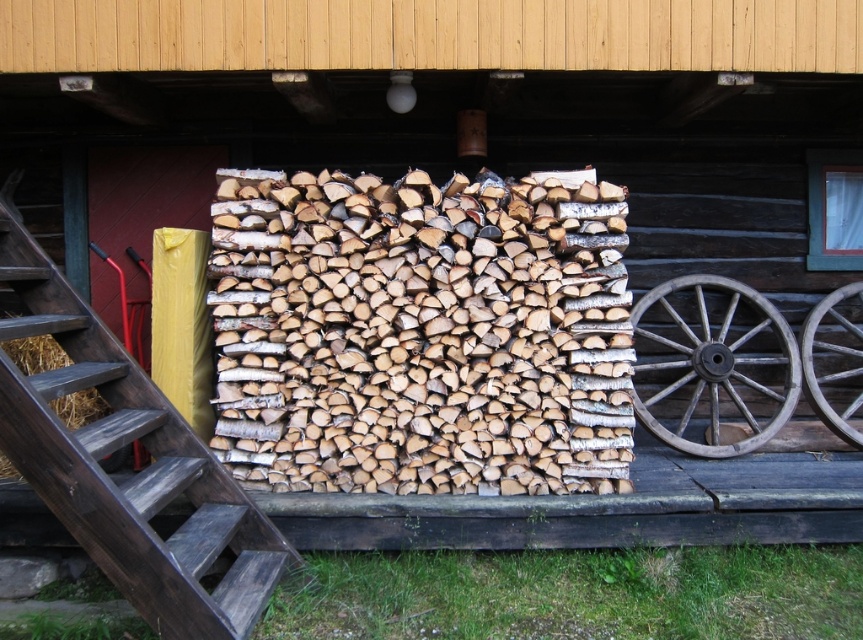
Question: Can you confirm if wooden stairs at left is positioned to the right of dark brown wooden wagon wheel at right?

Choices:
 (A) no
 (B) yes

Answer: (A)

Question: Does wooden stairs at left lie in front of wooden at right?

Choices:
 (A) yes
 (B) no

Answer: (A)

Question: Which of the following is the farthest from the observer?

Choices:
 (A) (702, 356)
 (B) (839, 435)

Answer: (A)

Question: Which of the following is the farthest from the observer?

Choices:
 (A) (210, 544)
 (B) (854, 339)
 (C) (745, 435)

Answer: (B)

Question: Does dark brown wooden wagon wheel at right appear on the left side of wooden at right?

Choices:
 (A) no
 (B) yes

Answer: (B)

Question: Considering the real-world distances, which object is farthest from the wooden stairs at left?

Choices:
 (A) wooden at right
 (B) dark brown wooden wagon wheel at right

Answer: (A)